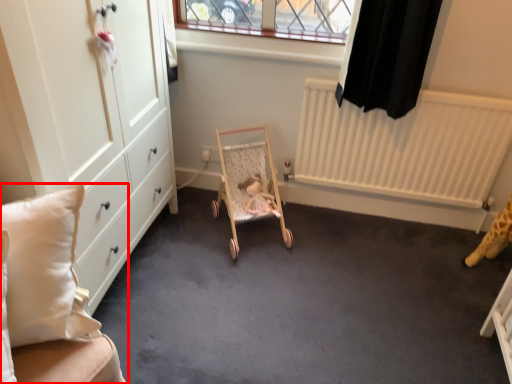
Question: From the image's perspective, where is furniture (annotated by the red box) located in relation to baby carriage in the image?

Choices:
 (A) below
 (B) above

Answer: (A)